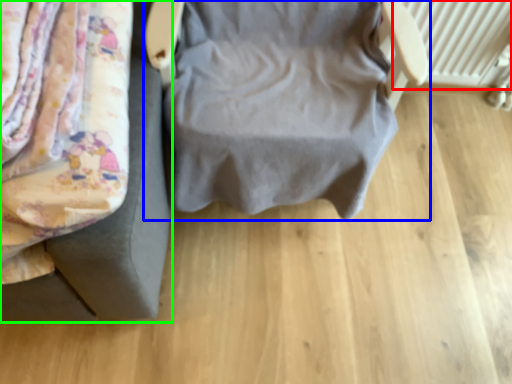
Question: Which object is positioned farthest from radiator (highlighted by a red box)? Select from furniture (highlighted by a blue box) and furniture (highlighted by a green box).

Choices:
 (A) furniture
 (B) furniture

Answer: (B)